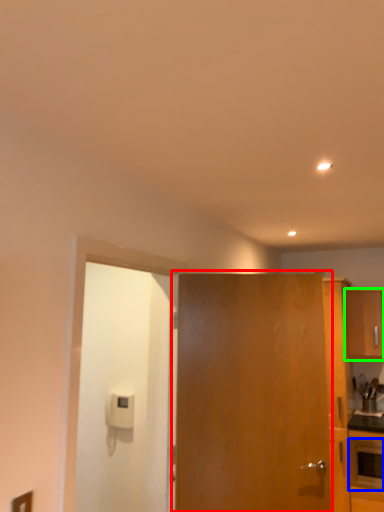
Question: Which object is positioned farthest from door (highlighted by a red box)? Select from appliance (highlighted by a blue box) and cabinetry (highlighted by a green box).

Choices:
 (A) appliance
 (B) cabinetry

Answer: (B)